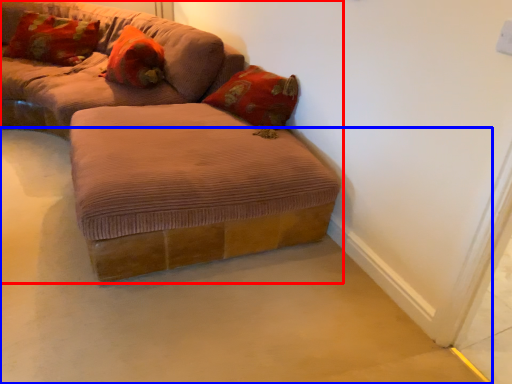
Question: Which point is closer to the camera, studio couch (highlighted by a red box) or concrete (highlighted by a blue box)?

Choices:
 (A) studio couch
 (B) concrete

Answer: (B)